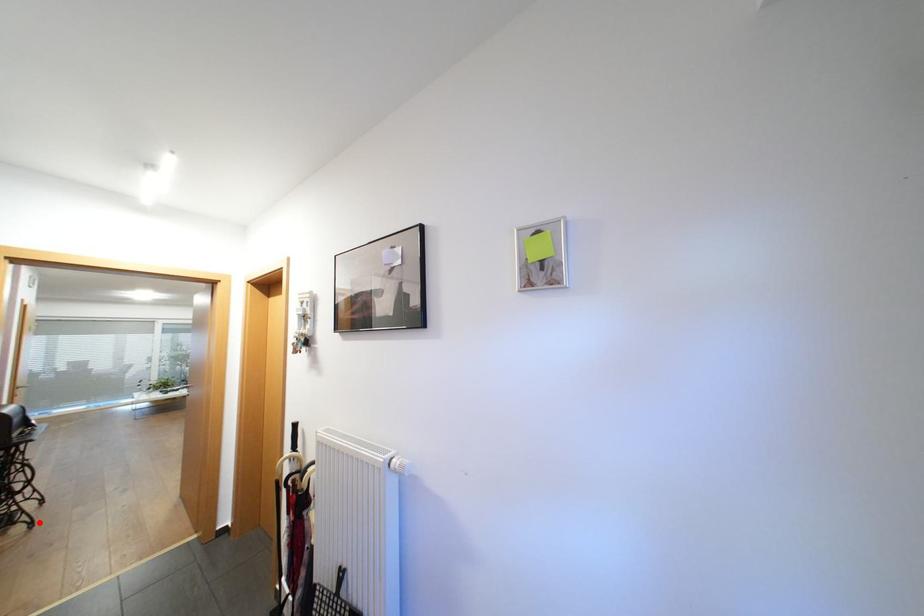
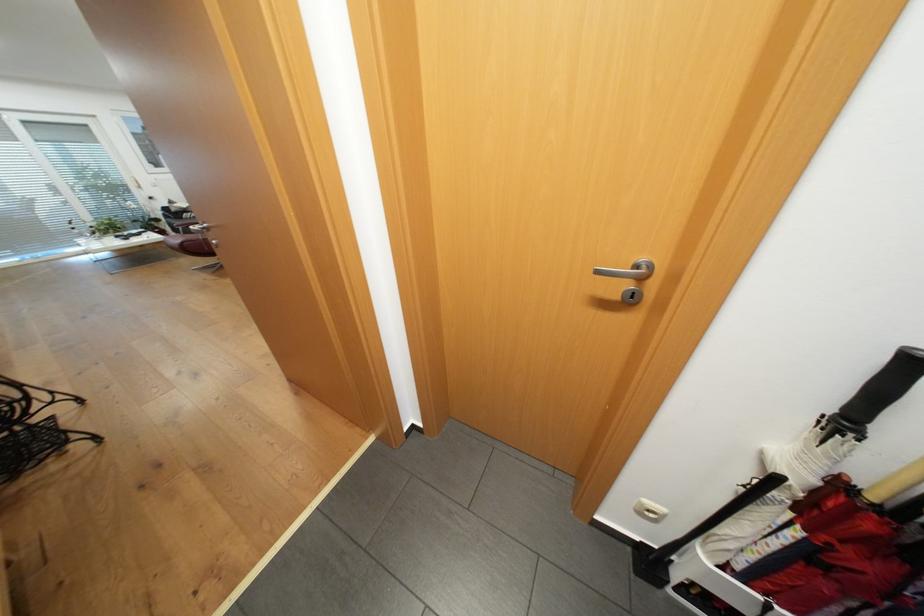
Question: I am providing you with two images of the same scene from different viewpoints. Image1 has a red point marked. In image2, the corresponding 3D location appears at what relative position? Reply with the corresponding letter.

Choices:
 (A) Closer
 (B) Farther

Answer: (A)